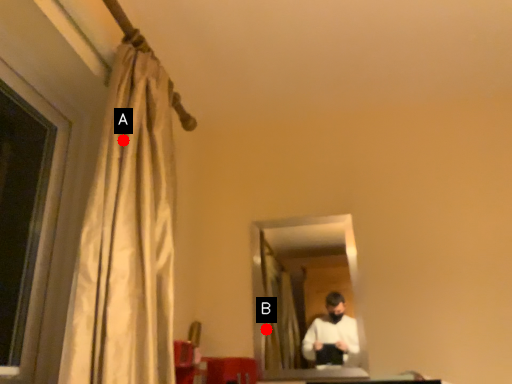
Question: Two points are circled on the image, labeled by A and B beside each circle. Which point is farther from the camera taking this photo?

Choices:
 (A) A is further
 (B) B is further

Answer: (B)